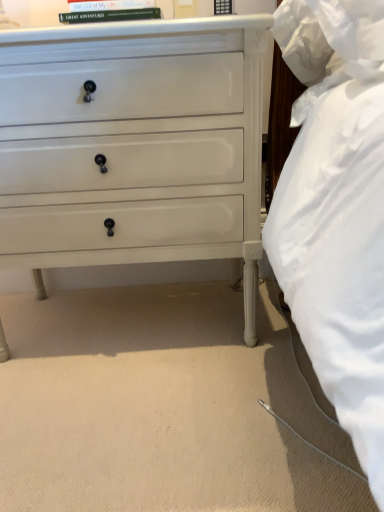
Question: Is the depth of white painted wood chest of drawers at center less than that of hardcover book at upper center?

Choices:
 (A) yes
 (B) no

Answer: (A)

Question: From the image's perspective, does white painted wood chest of drawers at center appear lower than hardcover book at upper center?

Choices:
 (A) yes
 (B) no

Answer: (A)

Question: Is white painted wood chest of drawers at center completely or partially outside of hardcover book at upper center?

Choices:
 (A) yes
 (B) no

Answer: (A)

Question: Is white painted wood chest of drawers at center placed right next to hardcover book at upper center?

Choices:
 (A) yes
 (B) no

Answer: (B)

Question: Is white painted wood chest of drawers at center taller than hardcover book at upper center?

Choices:
 (A) yes
 (B) no

Answer: (A)

Question: Does white painted wood chest of drawers at center appear on the left side of hardcover book at upper center?

Choices:
 (A) no
 (B) yes

Answer: (B)

Question: From a real-world perspective, is hardcover book at upper center located beneath white painted wood chest of drawers at center?

Choices:
 (A) no
 (B) yes

Answer: (A)

Question: Is hardcover book at upper center to the right of white painted wood chest of drawers at center from the viewer's perspective?

Choices:
 (A) no
 (B) yes

Answer: (B)

Question: Is hardcover book at upper center located outside white painted wood chest of drawers at center?

Choices:
 (A) no
 (B) yes

Answer: (B)

Question: Considering the relative sizes of hardcover book at upper center and white painted wood chest of drawers at center in the image provided, is hardcover book at upper center wider than white painted wood chest of drawers at center?

Choices:
 (A) no
 (B) yes

Answer: (A)

Question: Considering the relative sizes of hardcover book at upper center and white painted wood chest of drawers at center in the image provided, is hardcover book at upper center taller than white painted wood chest of drawers at center?

Choices:
 (A) no
 (B) yes

Answer: (A)

Question: Does hardcover book at upper center lie behind white painted wood chest of drawers at center?

Choices:
 (A) yes
 (B) no

Answer: (A)

Question: Is white painted wood chest of drawers at center bigger or smaller than hardcover book at upper center?

Choices:
 (A) big
 (B) small

Answer: (A)